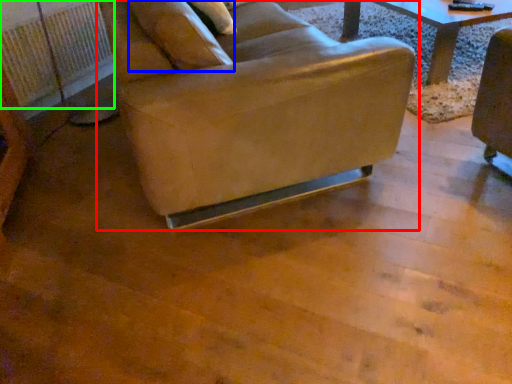
Question: Based on their relative distances, which object is farther from chair (highlighted by a red box)? Choose from pillow (highlighted by a blue box) and radiator (highlighted by a green box).

Choices:
 (A) pillow
 (B) radiator

Answer: (B)